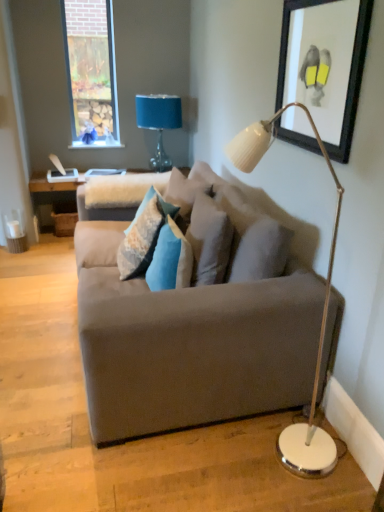
You are a GUI agent. You are given a task and a screenshot of the screen. Output one action in this format:
    pyautogui.click(x=<x>, y=<y>)
    Task: Click on the vacant area situated below white glossy floor lamp at right (from a real-world perspective)
    The image size is (384, 512).
    Given the screenshot: What is the action you would take?
    pyautogui.click(x=259, y=454)